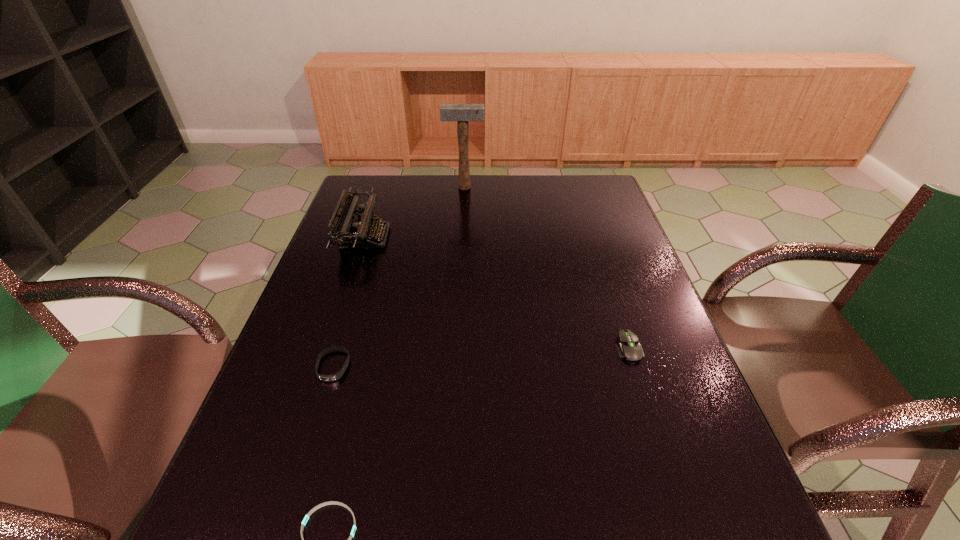
Locate an element on the screen. The height and width of the screenshot is (540, 960). the tallest object is located at coordinates (462, 113).

You are a GUI agent. You are given a task and a screenshot of the screen. Output one action in this format:
    pyautogui.click(x=<x>, y=<y>)
    Task: Click on the fourth object from left to right
    
    Given the screenshot: What is the action you would take?
    pyautogui.click(x=462, y=113)

Locate an element on the screen. The height and width of the screenshot is (540, 960). the fourth shortest object is located at coordinates [x=348, y=230].

I want to click on the second farthest object, so click(x=348, y=230).

Where is `the rightmost object`? This screenshot has width=960, height=540. the rightmost object is located at coordinates (629, 347).

This screenshot has height=540, width=960. I want to click on the taller wristband, so [x=327, y=378].

The width and height of the screenshot is (960, 540). What are the coordinates of `free spot located 0.110m on the right of the tallest object` in the screenshot? It's located at (515, 187).

Where is `free space located 0.290m on the typing side of the typewriter`? The height and width of the screenshot is (540, 960). free space located 0.290m on the typing side of the typewriter is located at coordinates (483, 238).

Where is `free space located on the front of the rightmost object`? The width and height of the screenshot is (960, 540). free space located on the front of the rightmost object is located at coordinates (649, 410).

The height and width of the screenshot is (540, 960). I want to click on vacant space located on the display of the farther wristband, so click(300, 470).